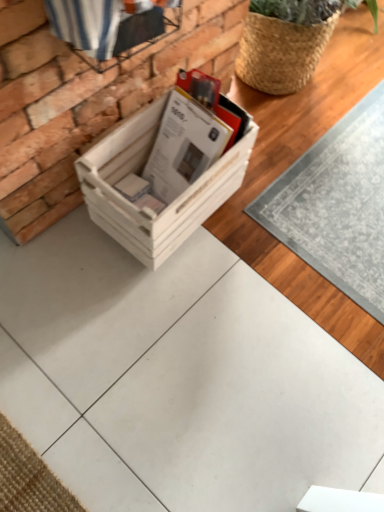
What is the approximate height of white wood crate at center?

The height of white wood crate at center is 13.36 inches.

Where is `white wood crate at center`? The image size is (384, 512). white wood crate at center is located at coordinates (166, 170).

The height and width of the screenshot is (512, 384). Describe the element at coordinates (166, 170) in the screenshot. I see `white wood crate at center` at that location.

Locate an element on the screen. Image resolution: width=384 pixels, height=512 pixels. white wood crate at center is located at coordinates (166, 170).